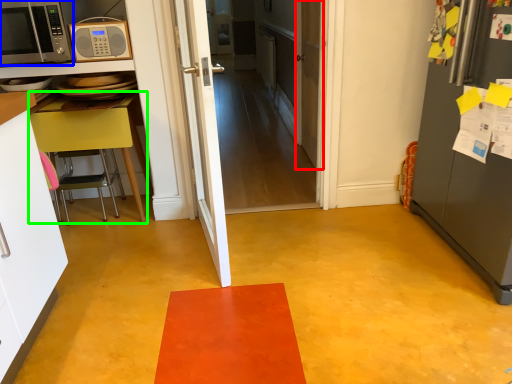
Question: Which is farther away from door (highlighted by a red box)? microwave oven (highlighted by a blue box) or table (highlighted by a green box)?

Choices:
 (A) microwave oven
 (B) table

Answer: (A)